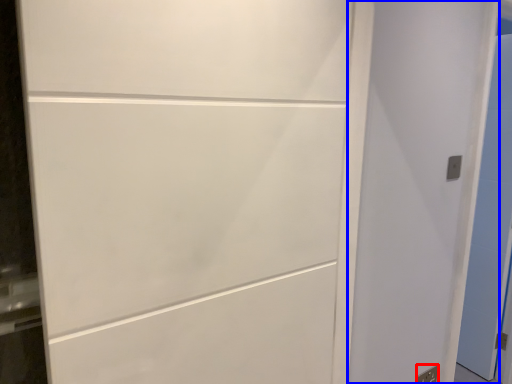
Question: Which point is further to the camera, electric outlet (highlighted by a red box) or door (highlighted by a blue box)?

Choices:
 (A) electric outlet
 (B) door

Answer: (A)